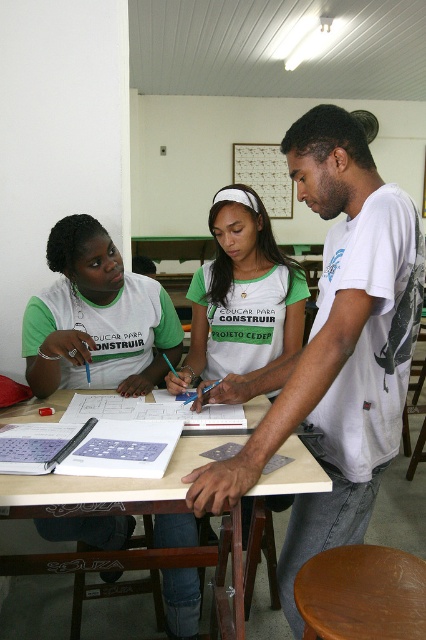
Question: Can you confirm if white t-shirt at center is wider than green fabric shirt at left?

Choices:
 (A) no
 (B) yes

Answer: (B)

Question: Which of the following is the closest to the observer?

Choices:
 (A) (308, 632)
 (B) (249, 156)

Answer: (A)

Question: In this image, where is white t-shirt at center located relative to wooden table at center?

Choices:
 (A) right
 (B) left

Answer: (A)

Question: Which of the following is the closest to the observer?

Choices:
 (A) (238, 369)
 (B) (250, 152)
 (C) (97, 508)
 (D) (324, 572)

Answer: (D)

Question: From the image, what is the correct spatial relationship of white t-shirt at center in relation to metallic grid at upper center?

Choices:
 (A) above
 (B) below

Answer: (B)

Question: Among these points, which one is nearest to the camera?

Choices:
 (A) (176, 477)
 (B) (65, 246)
 (C) (310, 620)
 (D) (285, 202)

Answer: (C)